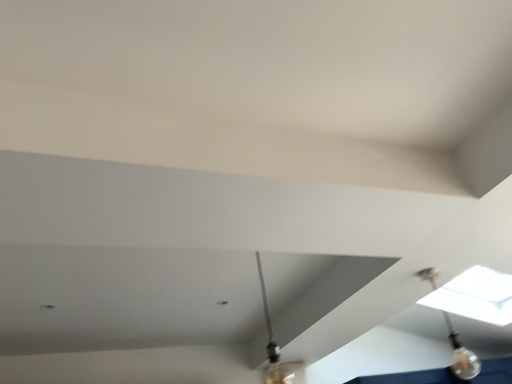
Question: Is clear glass bulb at upper right taller or shorter than metallic silver lamp at center?

Choices:
 (A) tall
 (B) short

Answer: (B)

Question: Looking at the image, does clear glass bulb at upper right seem bigger or smaller compared to metallic silver lamp at center?

Choices:
 (A) small
 (B) big

Answer: (A)

Question: Is clear glass bulb at upper right wider or thinner than metallic silver lamp at center?

Choices:
 (A) thin
 (B) wide

Answer: (A)

Question: In terms of height, does metallic silver lamp at center look taller or shorter compared to clear glass bulb at upper right?

Choices:
 (A) tall
 (B) short

Answer: (A)

Question: Is metallic silver lamp at center in front of or behind clear glass bulb at upper right in the image?

Choices:
 (A) front
 (B) behind

Answer: (A)

Question: From the image's perspective, is metallic silver lamp at center positioned above or below clear glass bulb at upper right?

Choices:
 (A) below
 (B) above

Answer: (B)

Question: Looking at their shapes, would you say metallic silver lamp at center is wider or thinner than clear glass bulb at upper right?

Choices:
 (A) thin
 (B) wide

Answer: (B)